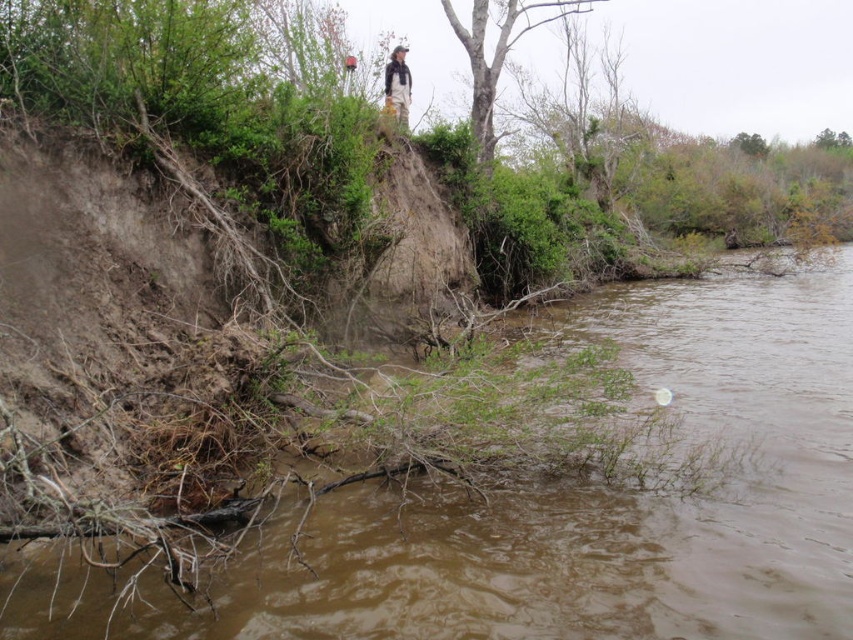
Which is in front, point (814, 365) or point (387, 93)?

Point (814, 365)

Can you confirm if brown muddy water at lower left is smaller than khaki pants at upper center?

Actually, brown muddy water at lower left might be larger than khaki pants at upper center.

Identify the location of brown muddy water at lower left. (602, 502).

Which of these two, brown muddy water at lower left or smooth bark tree at upper center, stands shorter?

brown muddy water at lower left is shorter.

Where is `brown muddy water at lower left`? This screenshot has height=640, width=853. brown muddy water at lower left is located at coordinates (602, 502).

Does smooth bark tree at upper center appear over khaki pants at upper center?

Correct, smooth bark tree at upper center is located above khaki pants at upper center.

What do you see at coordinates (495, 58) in the screenshot? I see `smooth bark tree at upper center` at bounding box center [495, 58].

Between point (479, 3) and point (392, 65), which one is positioned in front?

Positioned in front is point (392, 65).

What are the coordinates of `smooth bark tree at upper center` in the screenshot? It's located at (495, 58).